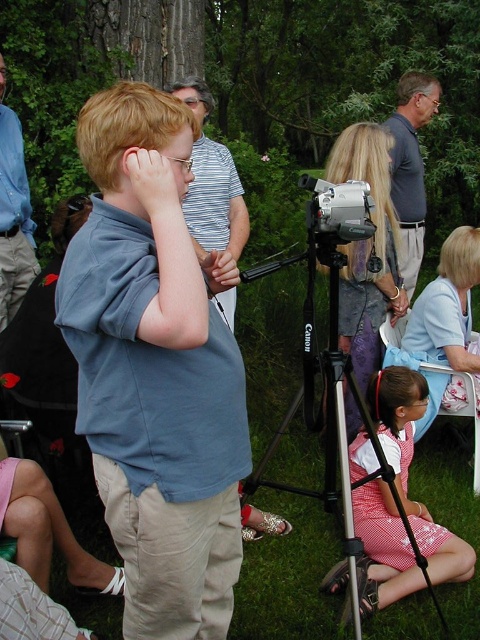
Question: Which object is the closest to the striped cotton shirt at center?

Choices:
 (A) gray cotton shirt at upper right
 (B) silver metallic video camera at center
 (C) polka dot dress at lower right
 (D) light blue shirt at center

Answer: (B)

Question: Does gray cotton shirt at upper right have a lesser width compared to silver metallic video camera at center?

Choices:
 (A) no
 (B) yes

Answer: (A)

Question: Which point is closer to the camera?

Choices:
 (A) (466, 356)
 (B) (377, 467)
 (C) (430, 115)
 (D) (222, 428)

Answer: (D)

Question: Which point is closer to the camera?

Choices:
 (A) gray cotton shirt at upper right
 (B) silver metallic video camera at center
 (C) striped cotton shirt at center
 (D) silver metallic tripod at lower center

Answer: (B)

Question: Does gray cotton shirt at upper right have a larger size compared to silver metallic video camera at center?

Choices:
 (A) yes
 (B) no

Answer: (A)

Question: Can you confirm if polka dot dress at lower right is positioned above gray cotton shirt at upper right?

Choices:
 (A) no
 (B) yes

Answer: (A)